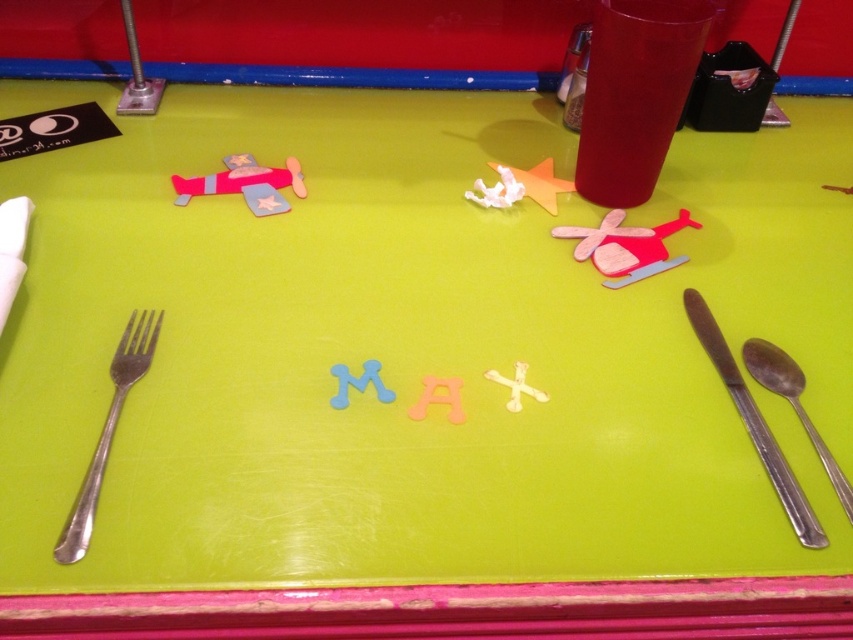
Question: Among these points, which one is nearest to the camera?

Choices:
 (A) (358, 387)
 (B) (418, 406)
 (C) (769, 438)

Answer: (C)

Question: Can you confirm if silver metallic knife and spoon at lower right is wider than blue foam letter m at center?

Choices:
 (A) no
 (B) yes

Answer: (A)

Question: Which point is farther to the camera?

Choices:
 (A) tap(538, 182)
 (B) tap(683, 218)
 (C) tap(358, 381)
 (D) tap(459, 410)

Answer: (A)

Question: Which point is farther to the camera?

Choices:
 (A) (460, 385)
 (B) (264, 204)

Answer: (B)

Question: Is silver metallic fork at left wider than pink felt airplane at upper left?

Choices:
 (A) yes
 (B) no

Answer: (B)

Question: Is silver metallic knife and spoon at lower right closer to the viewer compared to silver metallic spoon at lower right?

Choices:
 (A) no
 (B) yes

Answer: (B)